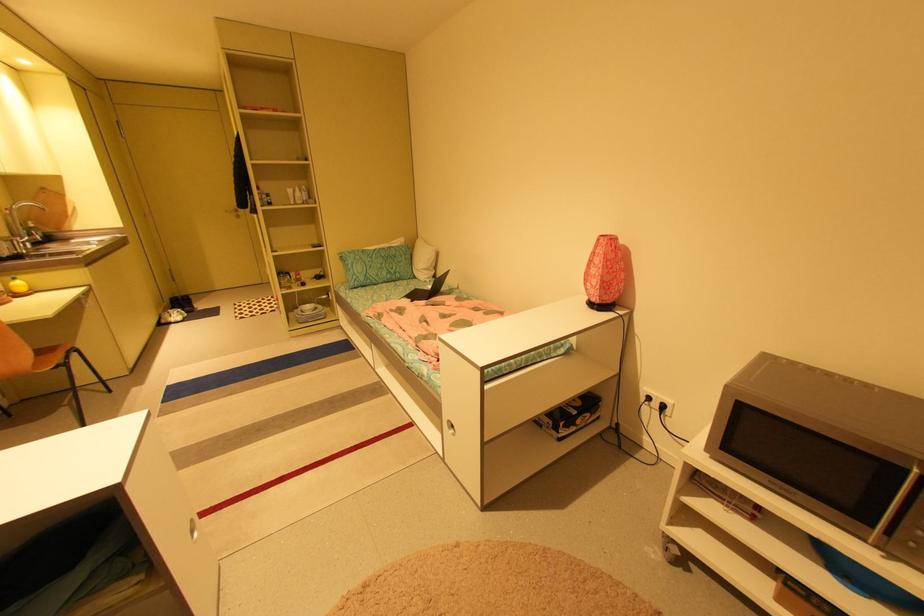
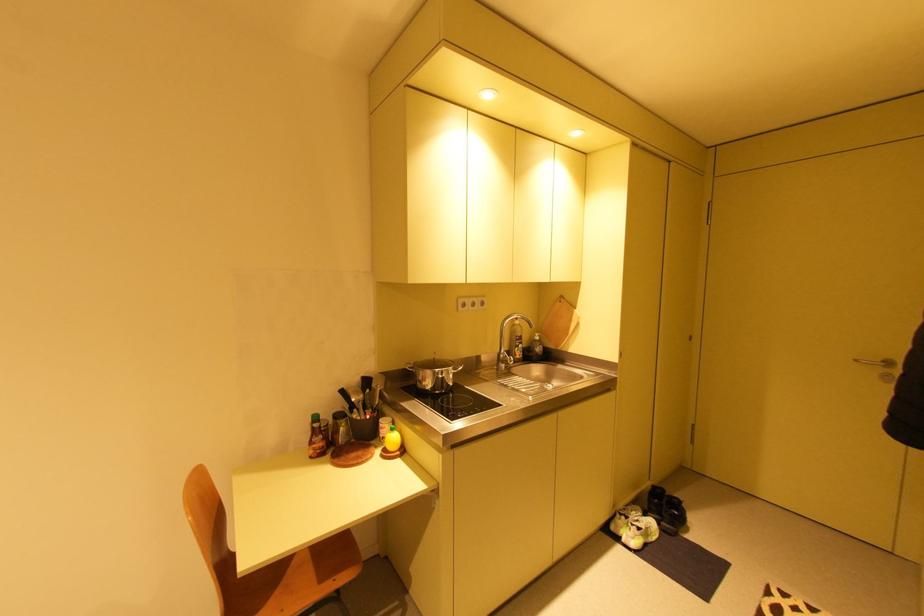
In the second image, find the point that corresponds to (169,322) in the first image.

(617, 528)